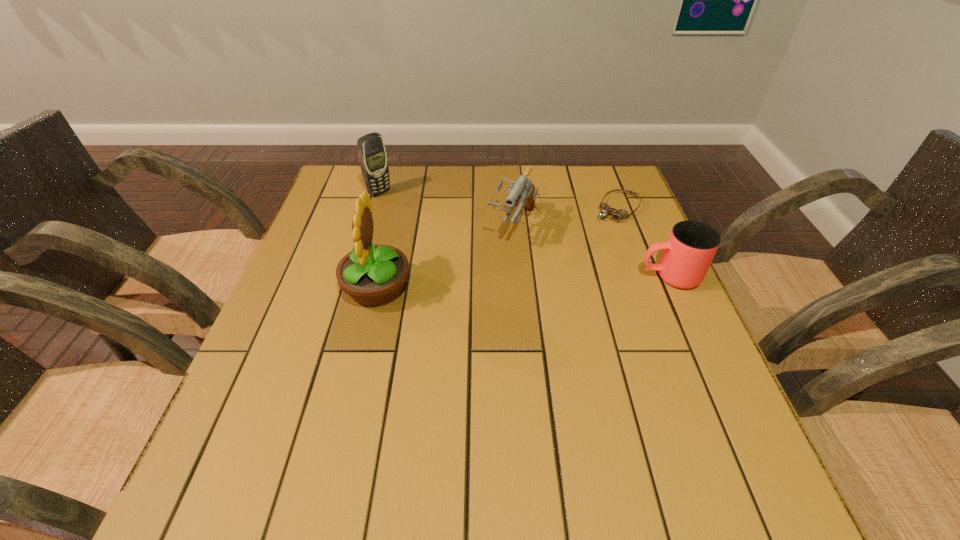
Locate an element on the screen. The height and width of the screenshot is (540, 960). vacant area that lies between the cellular telephone and the third tallest object is located at coordinates (447, 210).

At what (x,y) coordinates should I click in order to perform the action: click on free area in between the goggles and the tallest object. Please return your answer as a coordinate pair (x, y). The image size is (960, 540). Looking at the image, I should click on (497, 248).

Find the location of a particular element. The width and height of the screenshot is (960, 540). free area in between the tallest object and the cup is located at coordinates (523, 282).

The height and width of the screenshot is (540, 960). I want to click on empty space that is in between the cellular telephone and the sunflower, so click(x=378, y=240).

Identify the location of vacant area that lies between the cup and the tallest object. This screenshot has height=540, width=960. (523, 282).

Identify the location of the second closest object to the cup. This screenshot has width=960, height=540. (523, 188).

Identify which object is the fourth nearest to the cellular telephone. Please provide its 2D coordinates. Your answer should be formatted as a tuple, i.e. [(x, y)], where the tuple contains the x and y coordinates of a point satisfying the conditions above.

[(691, 246)]

The width and height of the screenshot is (960, 540). What are the coordinates of `free spot that satisfies the following two spatial constraints: 1. on the front side of the cup; 2. on the handle side of the third object from right to left` in the screenshot? It's located at (519, 276).

The height and width of the screenshot is (540, 960). What are the coordinates of `free spot that satisfies the following two spatial constraints: 1. on the front side of the sunflower; 2. on the face of the cellular telephone` in the screenshot? It's located at (351, 287).

The height and width of the screenshot is (540, 960). Identify the location of vacant space that satisfies the following two spatial constraints: 1. on the back side of the goggles; 2. on the right side of the third shortest object. pos(514,208).